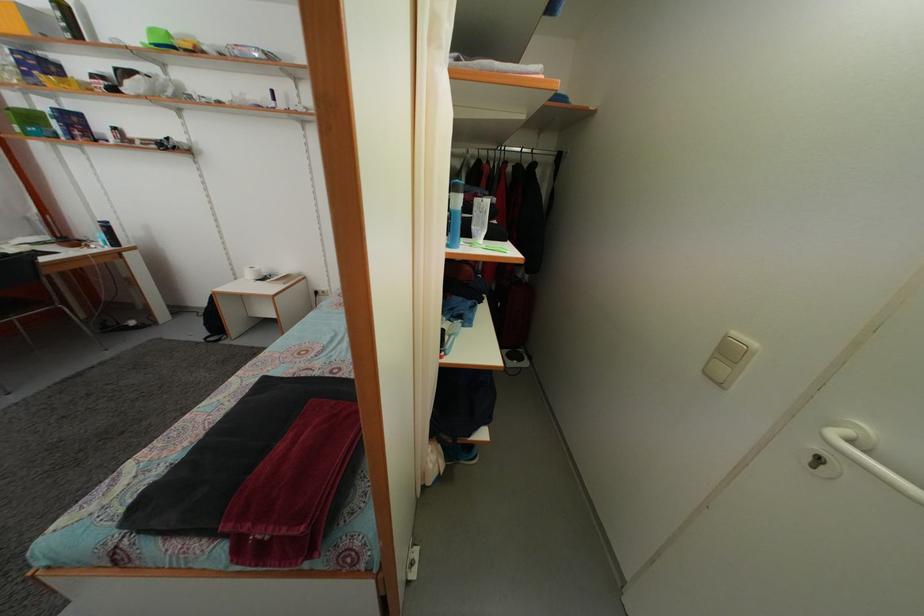
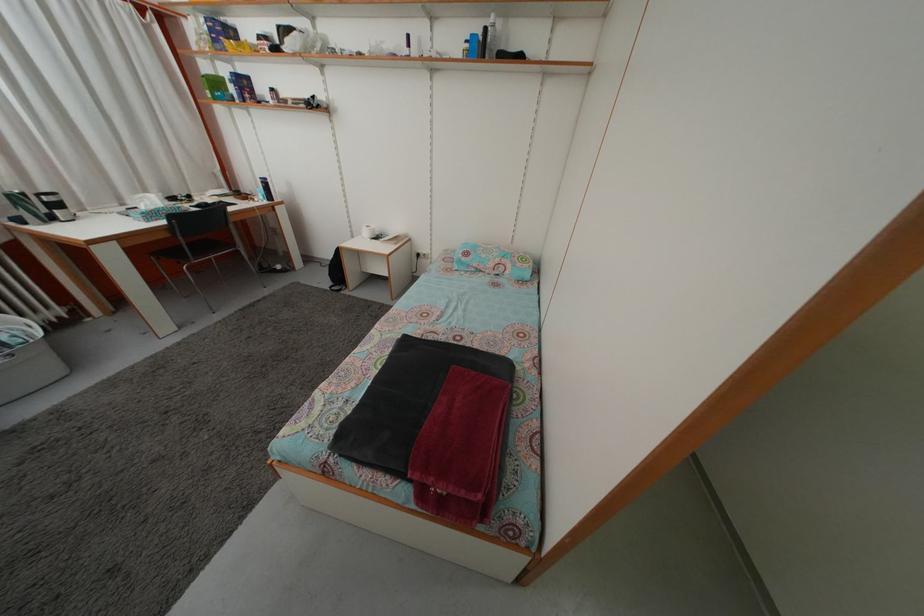
Where in the second image is the point corresponding to the point at 38,126 from the first image?

(223, 91)